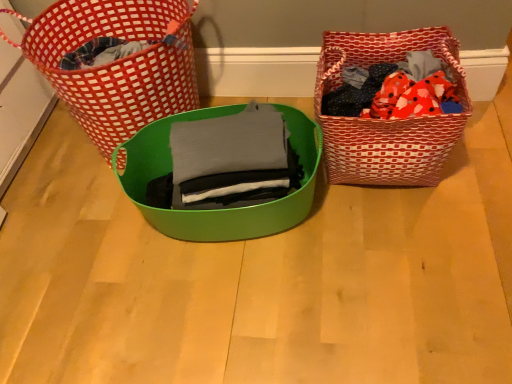
This screenshot has width=512, height=384. I want to click on free space to the left of red woven picnic basket at left, the first picnic basket positioned from the left, so click(x=47, y=165).